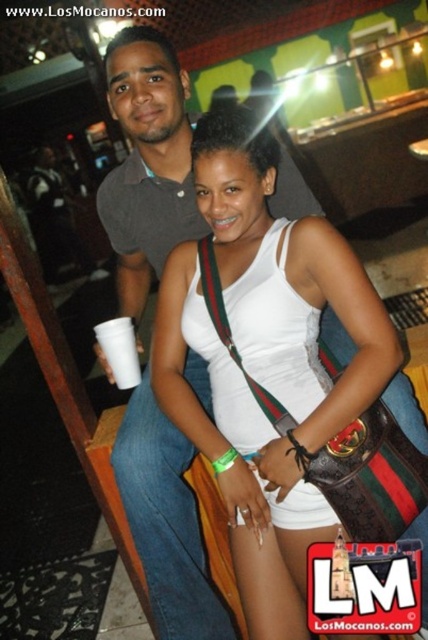
You are a photographer at the event and want to capture a photo where both the white matte tank top at center and the white paper cup at lower left are clearly visible. Considering their sizes, which object might appear larger in the final photo?

The white matte tank top at center appears larger in the photo because it is taller than the white paper cup at lower left.

You are a photographer at a social event. You notice two people in the crowd wearing the white matte tank top at center and the gray cotton shirt at upper left. Based on their positions in the image, which clothing item is higher up in the frame?

The white matte tank top at center is higher up in the frame than the gray cotton shirt at upper left because it is positioned above it.

You are standing in the venue and want to take a photo of the white matte tank top at center. Based on its position, where should you aim your camera?

The white matte tank top at center is located at point (x=267, y=364), so aim your camera towards the coordinates 0.570 on the horizontal axis and 0.624 on the vertical axis to capture it.